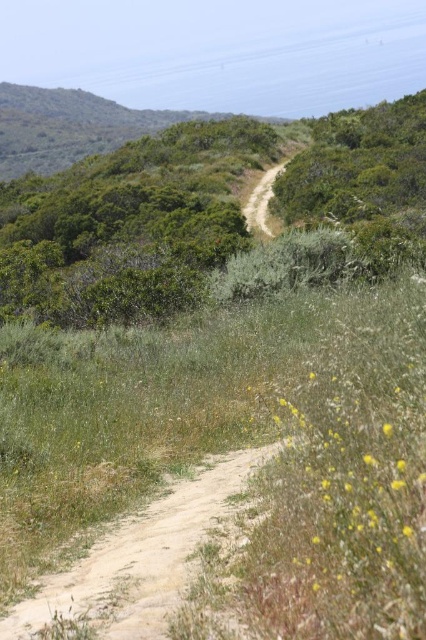
Is green leafy shrubs at upper left above dirt path at center?

No, green leafy shrubs at upper left is not above dirt path at center.

The image size is (426, 640). Describe the element at coordinates (206, 211) in the screenshot. I see `green leafy shrubs at upper left` at that location.

Where is `green leafy shrubs at upper left`? This screenshot has width=426, height=640. green leafy shrubs at upper left is located at coordinates (206, 211).